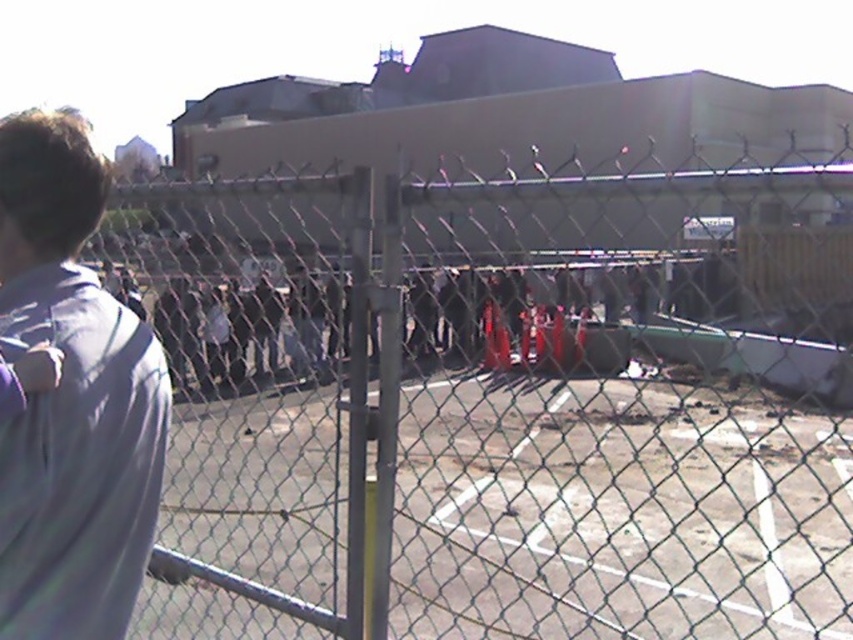
Question: Among these objects, which one is nearest to the camera?

Choices:
 (A) gray fabric shirt at left
 (B) chain link fence at left

Answer: (A)

Question: Does chain link fence at left appear on the right side of gray fabric shirt at left?

Choices:
 (A) no
 (B) yes

Answer: (B)

Question: Does chain link fence at left appear on the right side of gray fabric shirt at left?

Choices:
 (A) no
 (B) yes

Answer: (B)

Question: Does chain link fence at left appear on the left side of gray fabric shirt at left?

Choices:
 (A) yes
 (B) no

Answer: (B)

Question: Which object is closer to the camera taking this photo?

Choices:
 (A) gray fabric shirt at left
 (B) chain link fence at left

Answer: (A)